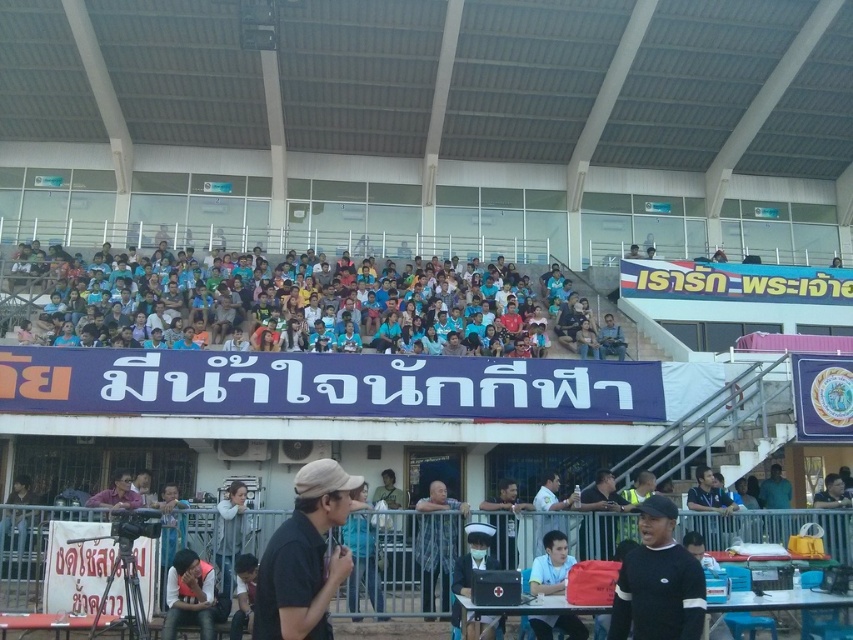
You are a spectator at the event and want to see both the light blue shirt at center and the white matte shirt at center clearly. Which one is positioned lower in the image?

The light blue shirt at center is below the white matte shirt at center, so the light blue shirt at center is positioned lower in the image.

You are a spectator at the event and you see the black matte cap at lower center and the light blue shirt at center. Which object is positioned more to the right side?

The black matte cap at lower center is positioned to the right of the light blue shirt at center, so the black matte cap at lower center is more to the right side.